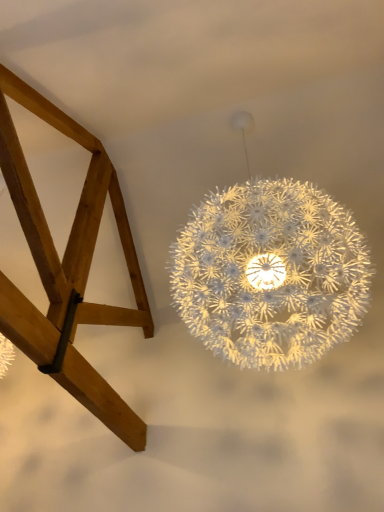
Question: From the image's perspective, is white matte spherical lamp at center positioned above or below light brown wood frame at lower left?

Choices:
 (A) below
 (B) above

Answer: (B)

Question: Do you think white matte spherical lamp at center is within light brown wood frame at lower left, or outside of it?

Choices:
 (A) inside
 (B) outside

Answer: (B)

Question: Based on their sizes in the image, would you say white matte spherical lamp at center is bigger or smaller than light brown wood frame at lower left?

Choices:
 (A) small
 (B) big

Answer: (B)

Question: Is light brown wood frame at lower left taller or shorter than white matte spherical lamp at center?

Choices:
 (A) tall
 (B) short

Answer: (B)

Question: Considering the positions of light brown wood frame at lower left and white matte spherical lamp at center in the image, is light brown wood frame at lower left wider or thinner than white matte spherical lamp at center?

Choices:
 (A) thin
 (B) wide

Answer: (B)

Question: Does point 46,247 appear closer or farther from the camera than point 238,281?

Choices:
 (A) closer
 (B) farther

Answer: (B)

Question: In the image, is light brown wood frame at lower left on the left side or the right side of white matte spherical lamp at center?

Choices:
 (A) left
 (B) right

Answer: (A)